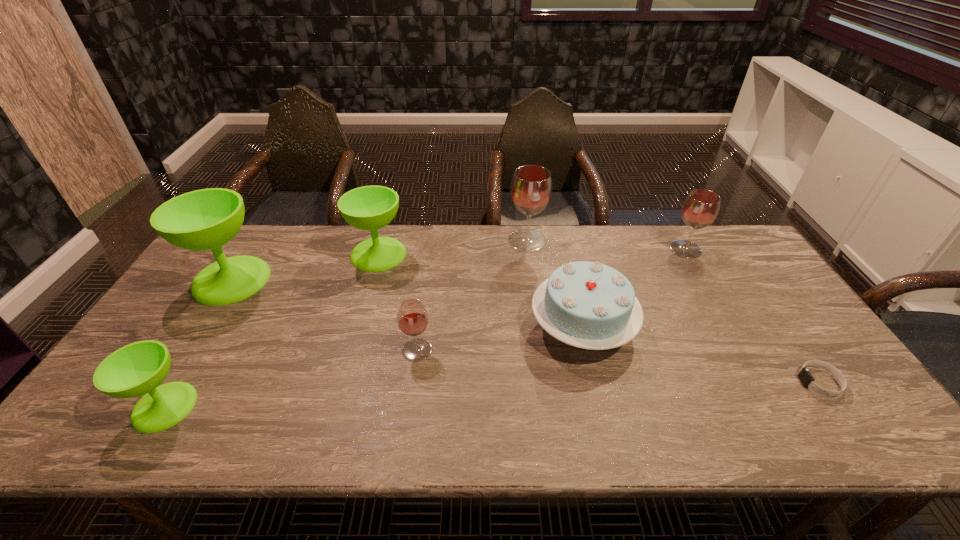
The image size is (960, 540). In order to click on blank space that satisfies the following two spatial constraints: 1. on the back side of the leftmost red wineglass; 2. on the left side of the second red wineglass from right to left in this screenshot , I will do `click(432, 241)`.